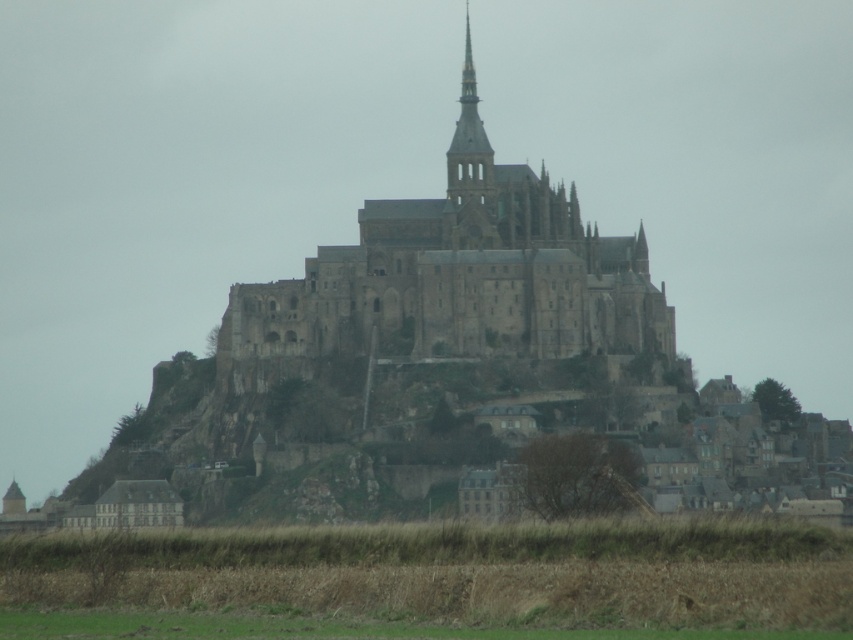
Question: Which object appears closest to the camera in this image?

Choices:
 (A) stone spire at upper center
 (B) gray stone castle at center

Answer: (B)

Question: In this image, where is gray stone castle at center located relative to stone spire at upper center?

Choices:
 (A) left
 (B) right

Answer: (A)

Question: Can you confirm if gray stone castle at center is positioned above stone spire at upper center?

Choices:
 (A) yes
 (B) no

Answer: (B)

Question: Which of the following is the closest to the observer?

Choices:
 (A) stone spire at upper center
 (B) gray stone castle at center

Answer: (B)

Question: Is gray stone castle at center below stone spire at upper center?

Choices:
 (A) yes
 (B) no

Answer: (A)